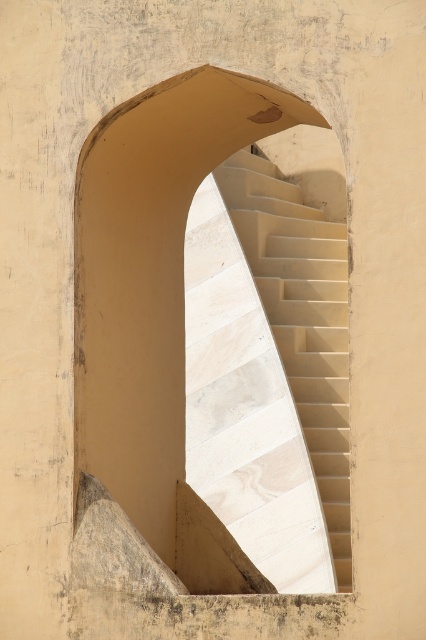
Consider the image. Between beige stone archway at center and beige marble stairs at center, which one appears on the right side from the viewer's perspective?

Positioned to the right is beige marble stairs at center.

Is beige stone archway at center to the right of beige marble stairs at center from the viewer's perspective?

In fact, beige stone archway at center is to the left of beige marble stairs at center.

At what (x,y) coordinates should I click in order to perform the action: click on beige stone archway at center. Please return your answer as a coordinate pair (x, y). Looking at the image, I should click on (213, 340).

Locate an element on the screen. The width and height of the screenshot is (426, 640). beige stone archway at center is located at coordinates (213, 340).